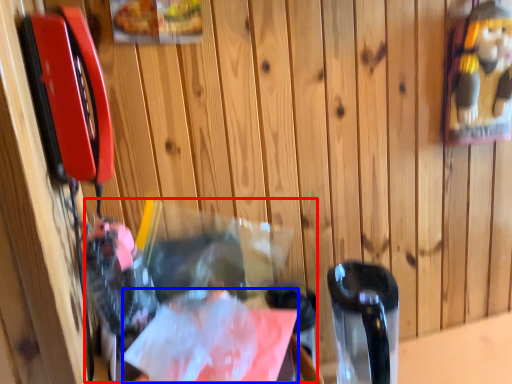
Question: Which object is closer to the camera taking this photo, waste (highlighted by a red box) or wrapping paper (highlighted by a blue box)?

Choices:
 (A) waste
 (B) wrapping paper

Answer: (A)